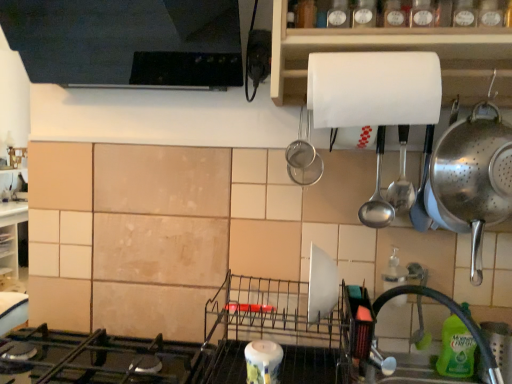
Question: Do you think white matte paper towel holder at upper center is within black rubber faucet at lower right, or outside of it?

Choices:
 (A) inside
 (B) outside

Answer: (B)

Question: From the image's perspective, is white matte paper towel holder at upper center positioned above or below black rubber faucet at lower right?

Choices:
 (A) above
 (B) below

Answer: (A)

Question: Considering the real-world distances, which object is farthest from the green translucent bottle at lower right?

Choices:
 (A) satin silver spoon at upper right
 (B) polished stainless steel colander at right, marked as the 2th appliance in a left-to-right arrangement
 (C) black matte gas stove at lower left
 (D) white glossy candle at lower center, the second appliance in the right-to-left sequence
 (E) white matte paper towel at upper center

Answer: (C)

Question: Which is farther from the white glossy candle at lower center, the 1th appliance in the left-to-right sequence?

Choices:
 (A) white matte paper towel at upper center
 (B) white matte paper towel holder at upper center
 (C) satin silver spoon at upper right
 (D) polished stainless steel colander at right, arranged as the 1th appliance when viewed from the top
 (E) black rubber faucet at lower right

Answer: (B)